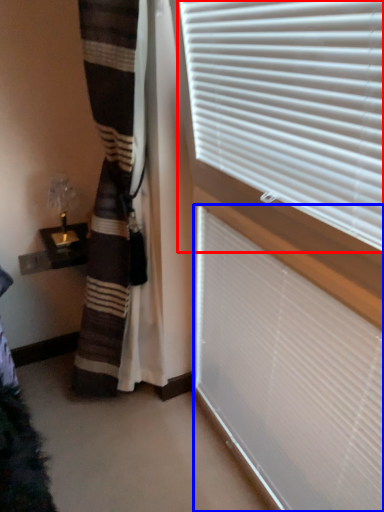
Question: Among these objects, which one is nearest to the camera, window blind (highlighted by a red box) or window blind (highlighted by a blue box)?

Choices:
 (A) window blind
 (B) window blind

Answer: (A)